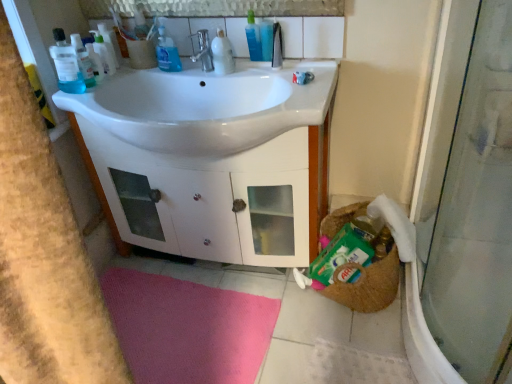
Question: Does satin nickel faucet at center have a greater width compared to white glossy cabinet at center?

Choices:
 (A) yes
 (B) no

Answer: (B)

Question: From a real-world perspective, is satin nickel faucet at center positioned over white glossy cabinet at center based on gravity?

Choices:
 (A) no
 (B) yes

Answer: (B)

Question: Is satin nickel faucet at center thinner than white glossy cabinet at center?

Choices:
 (A) yes
 (B) no

Answer: (A)

Question: Is satin nickel faucet at center behind white glossy cabinet at center?

Choices:
 (A) yes
 (B) no

Answer: (A)

Question: Can you confirm if satin nickel faucet at center is smaller than white glossy cabinet at center?

Choices:
 (A) yes
 (B) no

Answer: (A)

Question: Is satin nickel faucet at center at the left side of white glossy cabinet at center?

Choices:
 (A) yes
 (B) no

Answer: (B)

Question: Is blue liquid soap at upper center, which is the 2th cleaning product from right to left, at the right side of white glossy sink at center?

Choices:
 (A) no
 (B) yes

Answer: (A)

Question: From a real-world perspective, is blue liquid soap at upper center, which is the 2th cleaning product from right to left, on top of white glossy sink at center?

Choices:
 (A) no
 (B) yes

Answer: (B)

Question: Is blue liquid soap at upper center, which is the 1th cleaning product from left to right, to the left of white glossy sink at center from the viewer's perspective?

Choices:
 (A) no
 (B) yes

Answer: (B)

Question: Is blue liquid soap at upper center, which is the 2th cleaning product from right to left, wider than white glossy sink at center?

Choices:
 (A) yes
 (B) no

Answer: (B)

Question: From a real-world perspective, is blue liquid soap at upper center, which is the 2th cleaning product from right to left, beneath white glossy sink at center?

Choices:
 (A) yes
 (B) no

Answer: (B)

Question: Does blue liquid soap at upper center, which is the 1th cleaning product from left to right, have a smaller size compared to white glossy sink at center?

Choices:
 (A) no
 (B) yes

Answer: (B)

Question: From a real-world perspective, is satin nickel faucet at center over translucent plastic bottle at upper center?

Choices:
 (A) no
 (B) yes

Answer: (A)